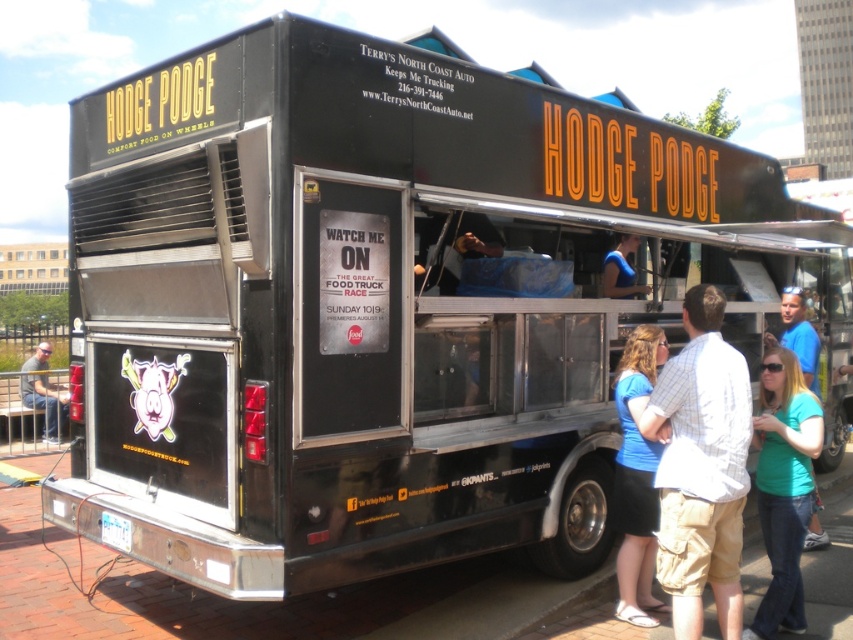
Does light blue shirt at center have a greater height compared to blue cotton shirt at center?

No.

Is light blue shirt at center further to camera compared to blue cotton shirt at center?

No, it is in front of blue cotton shirt at center.

Who is more forward, (676, 413) or (641, 561)?

Positioned in front is point (676, 413).

Find the location of a particular element. The image size is (853, 640). light blue shirt at center is located at coordinates (701, 467).

Who is positioned more to the right, matte gray shirt at lower left or blue fabric shirt at center?

blue fabric shirt at center is more to the right.

Is point (25, 362) closer to camera compared to point (613, 296)?

No, (25, 362) is further to viewer.

Locate an element on the screen. matte gray shirt at lower left is located at coordinates (44, 394).

You are a GUI agent. You are given a task and a screenshot of the screen. Output one action in this format:
    pyautogui.click(x=<x>, y=<y>)
    Task: Click on the matte gray shirt at lower left
    Image resolution: width=853 pixels, height=640 pixels.
    Given the screenshot: What is the action you would take?
    click(x=44, y=394)

Which is below, blue cotton shirt at center or teal shirt at center?

Positioned lower is blue cotton shirt at center.

Does blue cotton shirt at center have a larger size compared to teal shirt at center?

No, blue cotton shirt at center is not bigger than teal shirt at center.

What do you see at coordinates (636, 477) in the screenshot?
I see `blue cotton shirt at center` at bounding box center [636, 477].

This screenshot has width=853, height=640. In order to click on blue cotton shirt at center in this screenshot , I will do `click(636, 477)`.